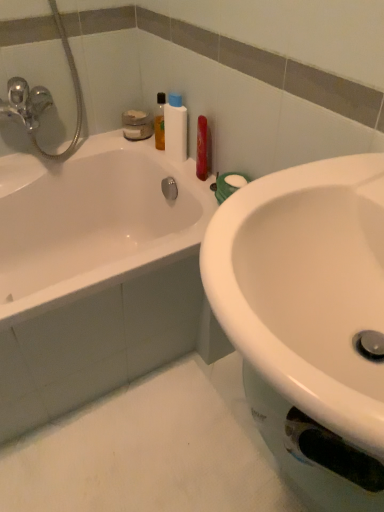
This screenshot has width=384, height=512. What do you see at coordinates (94, 274) in the screenshot?
I see `white glossy bathtub at upper left` at bounding box center [94, 274].

Find the location of a particular element. Image resolution: width=384 pixels, height=512 pixels. white plastic bottle at upper center is located at coordinates (175, 128).

Image resolution: width=384 pixels, height=512 pixels. I want to click on white glossy sink at center, so click(307, 287).

Can you confirm if white glossy sink at center is positioned to the left of white glossy bathtub at upper left?

Incorrect, white glossy sink at center is not on the left side of white glossy bathtub at upper left.

Based on their sizes in the image, would you say white glossy sink at center is bigger or smaller than white glossy bathtub at upper left?

Considering their sizes, white glossy sink at center takes up less space than white glossy bathtub at upper left.

Can you tell me how much white glossy sink at center and white glossy bathtub at upper left differ in facing direction?

There is a 90-degree angle between the facing directions of white glossy sink at center and white glossy bathtub at upper left.

Between white glossy sink at center and white glossy bathtub at upper left, which one has less height?

With less height is white glossy sink at center.

Which of these two, white plastic bottle at upper center or white glossy sink at center, stands shorter?

white glossy sink at center is shorter.

From the image's perspective, who appears lower, white plastic bottle at upper center or white glossy sink at center?

white glossy sink at center is shown below in the image.

Is white plastic bottle at upper center in contact with white glossy sink at center?

No, white plastic bottle at upper center is not next to white glossy sink at center.

Identify the location of bathtub on the left of white glossy sink at center. This screenshot has height=512, width=384. (94, 274).

Which point is more distant from viewer, (3, 178) or (222, 313)?

The point (3, 178) is behind.

Does white glossy bathtub at upper left have a greater height compared to white glossy sink at center?

Correct, white glossy bathtub at upper left is much taller as white glossy sink at center.

How far apart are white glossy bathtub at upper left and white glossy sink at center?

white glossy bathtub at upper left and white glossy sink at center are 26.01 inches apart from each other.

Is white glossy sink at center not near white plastic bottle at upper center?

white glossy sink at center is actually quite close to white plastic bottle at upper center.

Which object is closer to the camera, white glossy sink at center or white plastic bottle at upper center?

white glossy sink at center.

Considering the sizes of objects white glossy sink at center and white plastic bottle at upper center in the image provided, who is wider, white glossy sink at center or white plastic bottle at upper center?

With larger width is white glossy sink at center.

Considering the relative sizes of white glossy bathtub at upper left and white plastic bottle at upper center in the image provided, is white glossy bathtub at upper left bigger than white plastic bottle at upper center?

Correct, white glossy bathtub at upper left is larger in size than white plastic bottle at upper center.

Are white glossy bathtub at upper left and white plastic bottle at upper center located far from each other?

No, white glossy bathtub at upper left is not far away from white plastic bottle at upper center.

Is white glossy bathtub at upper left looking in the opposite direction of white plastic bottle at upper center?

white glossy bathtub at upper left does not have its back to white plastic bottle at upper center.

Which is in front, point (94, 267) or point (176, 94)?

Positioned in front is point (94, 267).

Can you confirm if white plastic bottle at upper center is bigger than white glossy bathtub at upper left?

Incorrect, white plastic bottle at upper center is not larger than white glossy bathtub at upper left.

From the image's perspective, would you say white plastic bottle at upper center is shown under white glossy bathtub at upper left?

Incorrect, from the image's perspective, white plastic bottle at upper center is higher than white glossy bathtub at upper left.

From a real-world perspective, is white plastic bottle at upper center beneath white glossy bathtub at upper left?

No, from a real-world perspective, white plastic bottle at upper center is not under white glossy bathtub at upper left.

Can you confirm if white plastic bottle at upper center is wider than white glossy bathtub at upper left?

No, white plastic bottle at upper center is not wider than white glossy bathtub at upper left.

Find the location of `bathtub lying behind the white glossy sink at center`. bathtub lying behind the white glossy sink at center is located at coordinates (94, 274).

Where is `sink below the white plastic bottle at upper center (from the image's perspective)`? sink below the white plastic bottle at upper center (from the image's perspective) is located at coordinates (307, 287).

Estimate the real-world distances between objects in this image. Which object is closer to white plastic bottle at upper center, white glossy bathtub at upper left or white glossy sink at center?

white glossy bathtub at upper left.

From the image, which object appears to be nearer to white glossy bathtub at upper left, white glossy sink at center or white plastic bottle at upper center?

The object closer to white glossy bathtub at upper left is white plastic bottle at upper center.

Looking at the image, which one is located further to white glossy sink at center, white plastic bottle at upper center or white glossy bathtub at upper left?

The object further to white glossy sink at center is white plastic bottle at upper center.

Looking at the image, which one is located further to white glossy sink at center, white glossy bathtub at upper left or white plastic bottle at upper center?

Based on the image, white plastic bottle at upper center appears to be further to white glossy sink at center.

Estimate the real-world distances between objects in this image. Which object is further from white plastic bottle at upper center, white glossy sink at center or white glossy bathtub at upper left?

Based on the image, white glossy sink at center appears to be further to white plastic bottle at upper center.

Estimate the real-world distances between objects in this image. Which object is further from white glossy bathtub at upper left, white plastic bottle at upper center or white glossy sink at center?

white glossy sink at center lies further to white glossy bathtub at upper left than the other object.

Where is `bathtub between white glossy sink at center and white plastic bottle at upper center along the z-axis`? This screenshot has width=384, height=512. bathtub between white glossy sink at center and white plastic bottle at upper center along the z-axis is located at coordinates (94, 274).